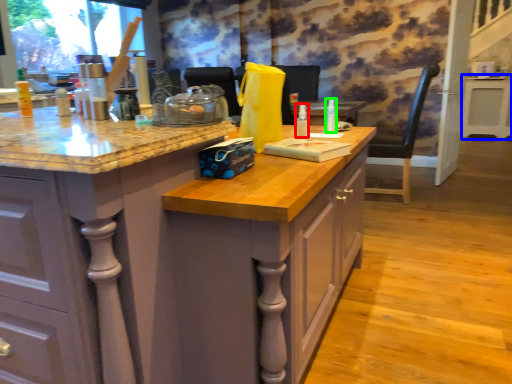
Question: Which object is positioned closest to bottle (highlighted by a red box)? Select from table (highlighted by a blue box) and bottle (highlighted by a green box).

Choices:
 (A) table
 (B) bottle

Answer: (B)